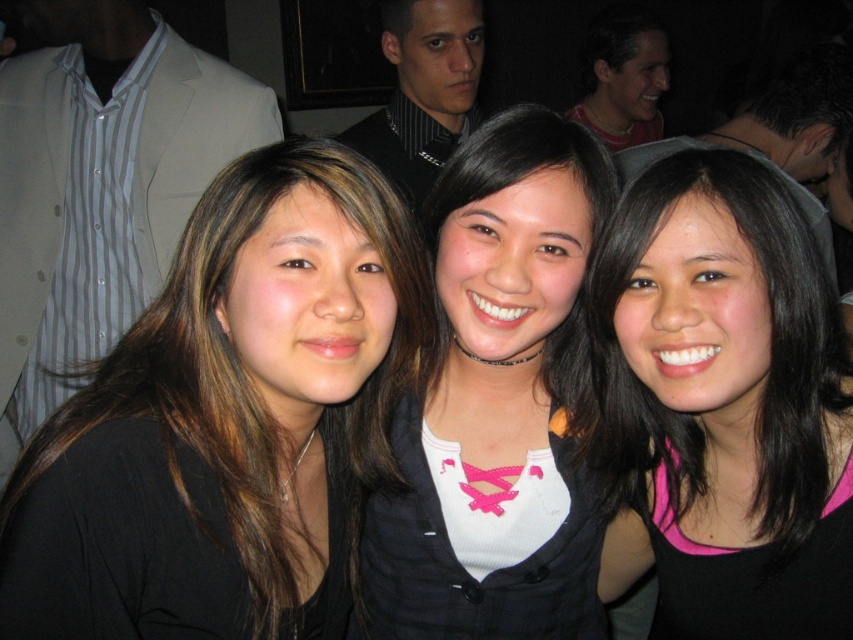
Can you confirm if pink matte tank top at center is positioned below dark brown hair at left?

Yes.

Between point (706, 614) and point (68, 145), which one is positioned behind?

The point (68, 145) is behind.

In order to click on pink matte tank top at center in this screenshot , I will do `click(724, 404)`.

In the scene shown: Is black matte hair at left wider than matte black shirt at upper center?

Yes, black matte hair at left is wider than matte black shirt at upper center.

Which of these two, black matte hair at left or matte black shirt at upper center, stands shorter?

Standing shorter between the two is black matte hair at left.

Where is `black matte hair at left`? This screenshot has width=853, height=640. black matte hair at left is located at coordinates (228, 420).

Who is more forward, (480, 284) or (13, 108)?

Point (480, 284) is more forward.

Who is more distant from viewer, (604, 202) or (97, 342)?

The point (97, 342) is more distant.

Is point (532, 552) less distant than point (109, 204)?

That is True.

I want to click on pink lace-up shirt at center, so click(498, 401).